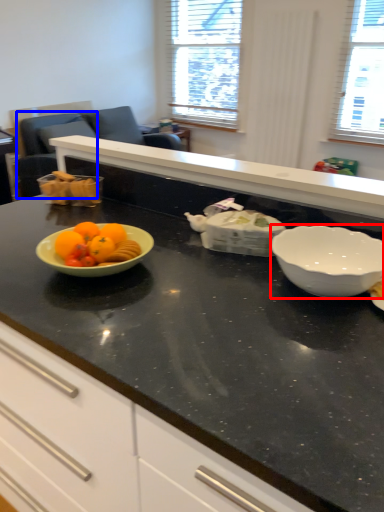
Question: Which object appears farthest to the camera in this image, bowl (highlighted by a red box) or armchair (highlighted by a blue box)?

Choices:
 (A) bowl
 (B) armchair

Answer: (B)